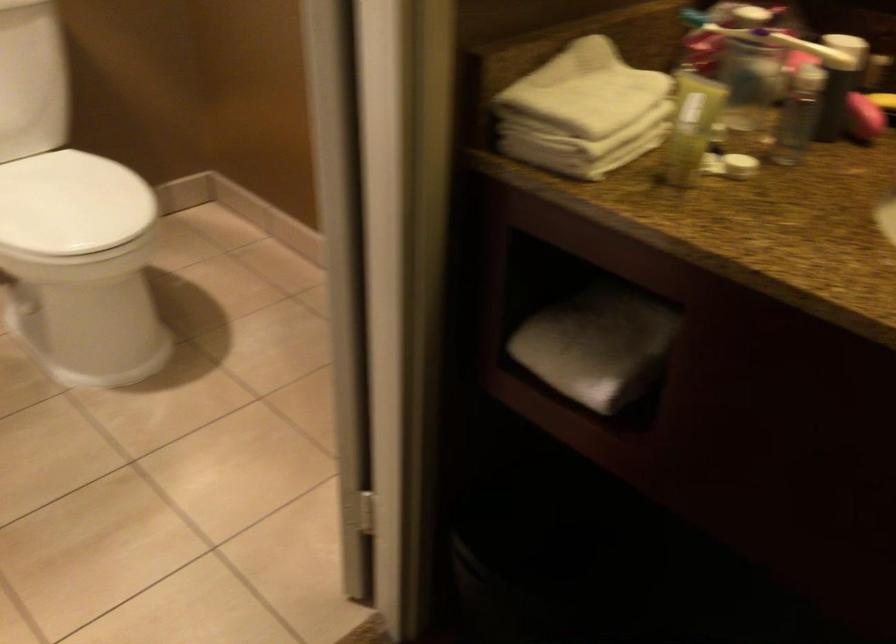
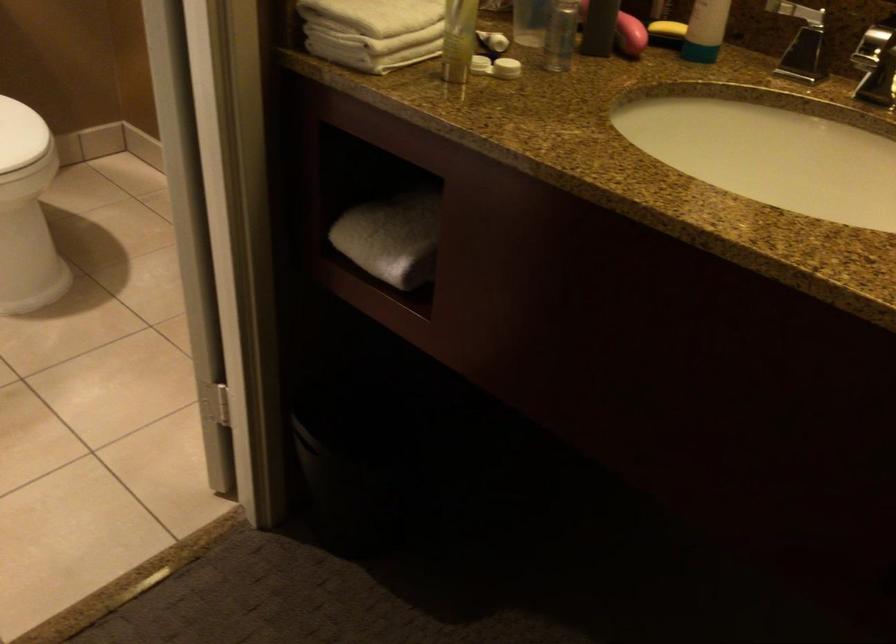
In the second image, find the point that corresponds to [739,165] in the first image.

(506, 68)